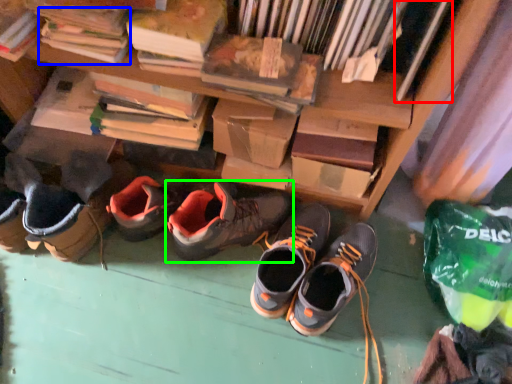
Question: Based on their relative distances, which object is nearer to book (highlighted by a red box)? Choose from book (highlighted by a blue box) and footwear (highlighted by a green box).

Choices:
 (A) book
 (B) footwear

Answer: (B)